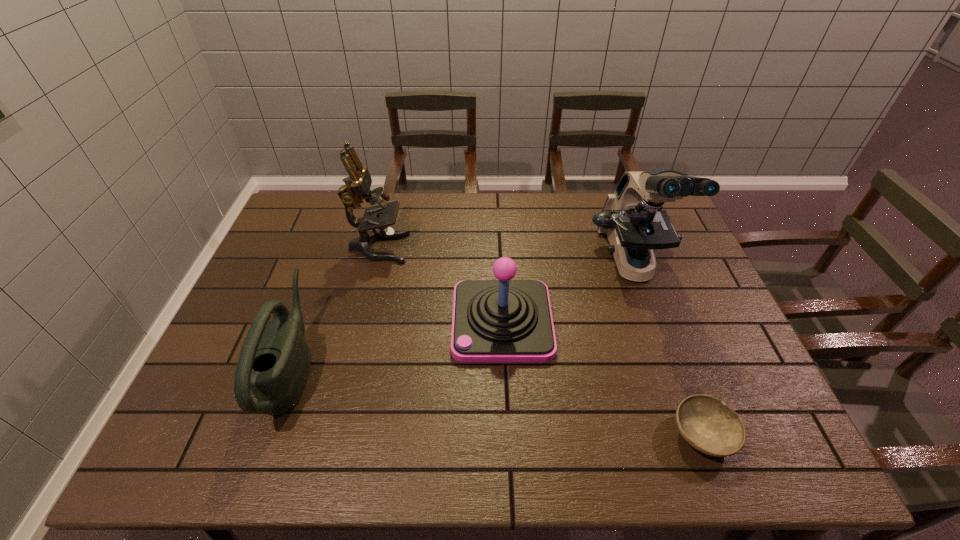
Find the location of `the right microscope`. the right microscope is located at coordinates (633, 219).

You are a GUI agent. You are given a task and a screenshot of the screen. Output one action in this format:
    pyautogui.click(x=<x>, y=<y>)
    Task: Click on the left microscope
    The width and height of the screenshot is (960, 540).
    Given the screenshot: What is the action you would take?
    pyautogui.click(x=357, y=188)

Locate an element on the screen. The width and height of the screenshot is (960, 540). the third object from left to right is located at coordinates (500, 321).

This screenshot has height=540, width=960. In order to click on watering can in this screenshot , I will do click(x=274, y=361).

The height and width of the screenshot is (540, 960). Find the location of `the shortest object`. the shortest object is located at coordinates (710, 426).

Locate an element on the screen. This screenshot has width=960, height=540. free space located 0.050m through the eyepieces of the right microscope is located at coordinates (653, 323).

This screenshot has width=960, height=540. Identify the location of vacant space situated 0.210m at the eyepieces of the left microscope. (473, 248).

Identify the location of free location located forward from the base of the third object from right to left. This screenshot has width=960, height=540. (405, 321).

The image size is (960, 540). I want to click on vacant area situated forward from the base of the third object from right to left, so click(x=306, y=321).

Where is `vacant area situated forward from the base of the third object from right to left`? The image size is (960, 540). vacant area situated forward from the base of the third object from right to left is located at coordinates (313, 321).